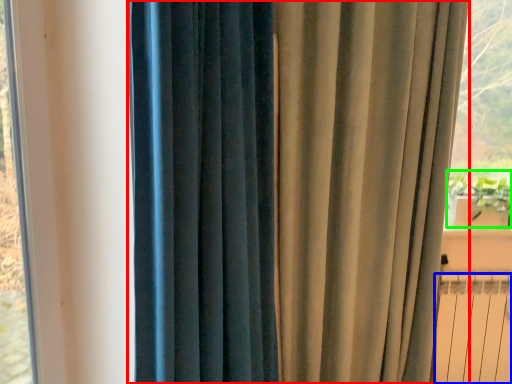
Question: Based on their relative distances, which object is farther from curtain (highlighted by a red box)? Choose from radiator (highlighted by a blue box) and plant (highlighted by a green box).

Choices:
 (A) radiator
 (B) plant

Answer: (B)